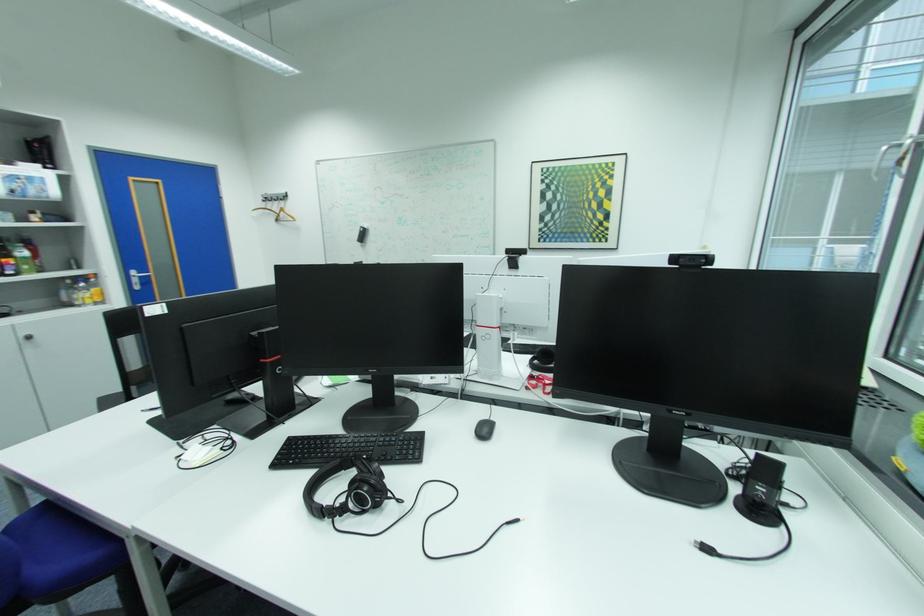
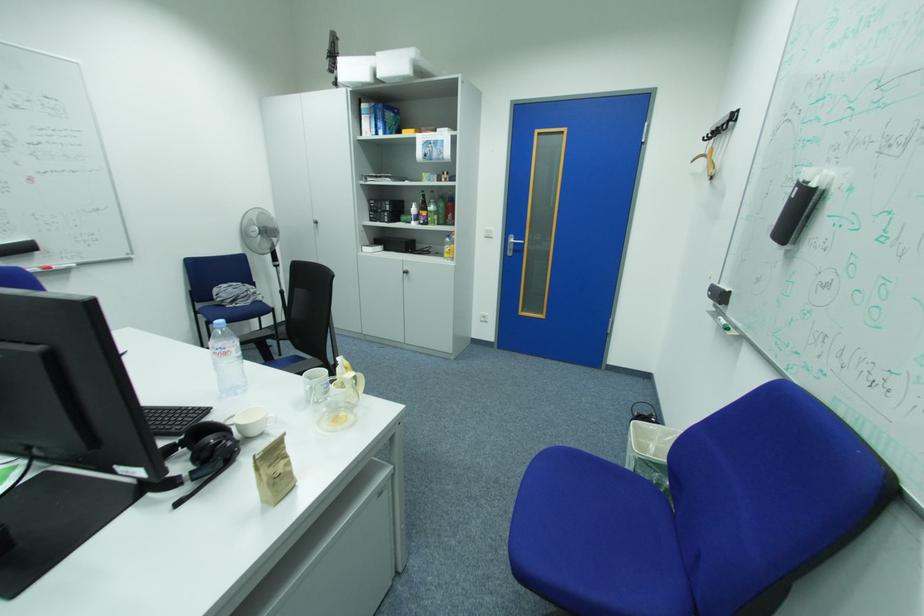
Locate, in the second image, the point that corresponds to point 143,275 in the first image.

(520, 240)